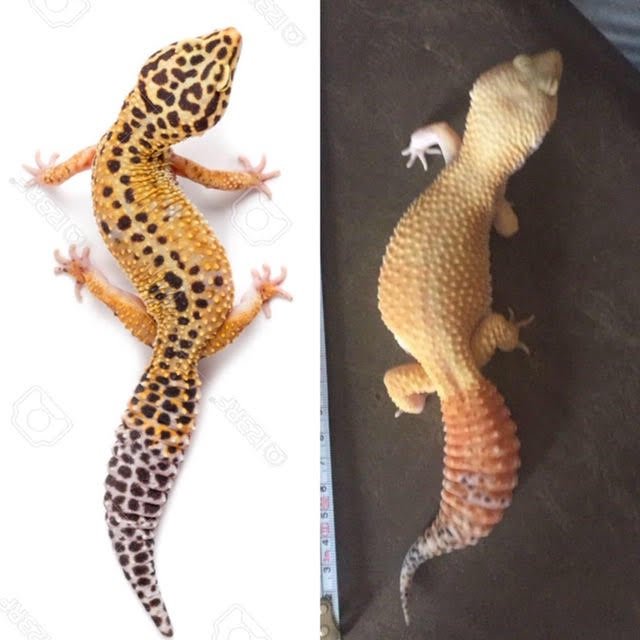
This screenshot has height=640, width=640. What are the coordinates of `table` in the screenshot? It's located at (562, 596).